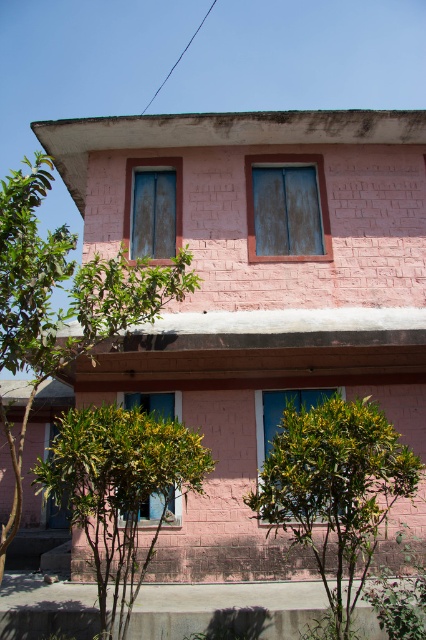
Question: Does green leafy tree at left appear over blue glass window at center?

Choices:
 (A) no
 (B) yes

Answer: (B)

Question: Which of the following is the farthest from the observer?

Choices:
 (A) (169, 502)
 (B) (25, 276)

Answer: (A)

Question: Does green leafy tree at left appear over blue glass window at center?

Choices:
 (A) yes
 (B) no

Answer: (A)

Question: Can you confirm if blue matte window at center is positioned above blue glass window at lower left?

Choices:
 (A) yes
 (B) no

Answer: (A)

Question: Which point is farther to the camera?

Choices:
 (A) green leafy bush at lower center
 (B) green leafy tree at lower left
 (C) blue matte window at center

Answer: (C)

Question: Which point appears farthest from the camera in this image?

Choices:
 (A) (81, 460)
 (B) (267, 392)
 (C) (268, 458)
 (D) (98, 324)

Answer: (B)